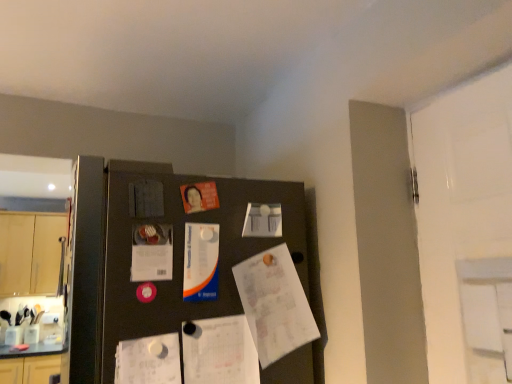
The height and width of the screenshot is (384, 512). What do you see at coordinates (149, 360) in the screenshot?
I see `white paper at lower left, the 6th poster when ordered from top to bottom` at bounding box center [149, 360].

This screenshot has width=512, height=384. What do you see at coordinates (201, 262) in the screenshot?
I see `blue glossy poster at center, the 5th poster viewed from the top` at bounding box center [201, 262].

Locate an element on the screen. This screenshot has height=384, width=512. white glossy paper at upper center, the third poster when ordered from top to bottom is located at coordinates (263, 220).

Locate an element on the screen. This screenshot has height=384, width=512. metallic silver poster at center, positioned as the 6th poster in bottom-to-top order is located at coordinates (146, 198).

I want to click on matte paper poster at center-left, which appears as the 4th poster when ordered from the bottom, so click(152, 253).

What are the coordinates of `white paper at lower left, the 6th poster when ordered from top to bottom` in the screenshot? It's located at (149, 360).

Is black matte fridge at center closer to the viewer compared to white paper at lower left, the 2th poster from the bottom?

Yes, it is.

Between black matte fridge at center and white paper at lower left, the 2th poster from the bottom, which one has smaller width?

Thinner between the two is white paper at lower left, the 2th poster from the bottom.

Locate an element on the screen. The height and width of the screenshot is (384, 512). fridge that is above the white paper at lower left, the 6th poster when ordered from top to bottom (from a real-world perspective) is located at coordinates (188, 286).

Considering the relative sizes of black matte fridge at center and white paper at lower left, the 6th poster when ordered from top to bottom, in the image provided, is black matte fridge at center taller than white paper at lower left, the 6th poster when ordered from top to bottom,?

Yes.

From a real-world perspective, which object rests below the other?

black matte fridge at center, from a real-world perspective.

Which of these two, light wood cabinet at left or black matte fridge at center, is bigger?

black matte fridge at center.

From the image's perspective, is light wood cabinet at left located above or below black matte fridge at center?

Clearly, from the image's perspective, light wood cabinet at left is below black matte fridge at center.

Could you tell me if light wood cabinet at left is facing black matte fridge at center?

Yes, light wood cabinet at left is turned towards black matte fridge at center.

Is metallic silver poster at center, positioned as the 6th poster in bottom-to-top order, positioned far away from orange matte poster at upper center, marked as the 1th poster in a top-to-bottom arrangement?

No, there isn't a large distance between metallic silver poster at center, positioned as the 6th poster in bottom-to-top order, and orange matte poster at upper center, marked as the 1th poster in a top-to-bottom arrangement.

From the image's perspective, relative to orange matte poster at upper center, marked as the 1th poster in a top-to-bottom arrangement, is metallic silver poster at center, the 2th poster when ordered from top to bottom, above or below?

From the image's perspective, metallic silver poster at center, the 2th poster when ordered from top to bottom, appears below orange matte poster at upper center, marked as the 1th poster in a top-to-bottom arrangement.

Which of these two, metallic silver poster at center, positioned as the 6th poster in bottom-to-top order, or orange matte poster at upper center, marked as the 1th poster in a top-to-bottom arrangement, is wider?

With larger width is metallic silver poster at center, positioned as the 6th poster in bottom-to-top order.

Based on the photo, could you tell me if metallic silver poster at center, positioned as the 6th poster in bottom-to-top order, is facing orange matte poster at upper center, the 7th poster positioned from the bottom?

No.

Is metallic silver poster at center, the 2th poster when ordered from top to bottom, facing towards matte paper poster at center-left, which appears as the 4th poster when ordered from the bottom?

No, metallic silver poster at center, the 2th poster when ordered from top to bottom, is not turned towards matte paper poster at center-left, which appears as the 4th poster when ordered from the bottom.

From the image's perspective, is metallic silver poster at center, positioned as the 6th poster in bottom-to-top order, below matte paper poster at center-left, which appears as the 4th poster when ordered from the bottom?

Actually, metallic silver poster at center, positioned as the 6th poster in bottom-to-top order, appears above matte paper poster at center-left, which appears as the 4th poster when ordered from the bottom, in the image.

Which of these two, metallic silver poster at center, the 2th poster when ordered from top to bottom, or matte paper poster at center-left, which appears as the 4th poster when ordered from the bottom, stands taller?

Standing taller between the two is matte paper poster at center-left, which appears as the 4th poster when ordered from the bottom.

From a real-world perspective, which is physically below, blue glossy poster at center, which appears as the third poster when ordered from the bottom, or matte paper poster at center-left, which appears as the 4th poster when ordered from the bottom?

blue glossy poster at center, which appears as the third poster when ordered from the bottom, is physically lower.

Which is behind, point (214, 254) or point (143, 279)?

The point (214, 254) is more distant.

Is blue glossy poster at center, which appears as the third poster when ordered from the bottom, outside of matte paper poster at center-left, the 4th poster positioned from the top?

Yes, blue glossy poster at center, which appears as the third poster when ordered from the bottom, is not within matte paper poster at center-left, the 4th poster positioned from the top.

In the scene shown: Is blue glossy poster at center, the 5th poster viewed from the top, placed right next to matte paper poster at center-left, which appears as the 4th poster when ordered from the bottom?

Absolutely, blue glossy poster at center, the 5th poster viewed from the top, is next to and touching matte paper poster at center-left, which appears as the 4th poster when ordered from the bottom.

Consider the image. Considering the sizes of objects orange matte poster at upper center, marked as the 1th poster in a top-to-bottom arrangement, and matte paper poster at center-left, the 4th poster positioned from the top, in the image provided, who is bigger, orange matte poster at upper center, marked as the 1th poster in a top-to-bottom arrangement, or matte paper poster at center-left, the 4th poster positioned from the top,?

Bigger between the two is matte paper poster at center-left, the 4th poster positioned from the top.

Is orange matte poster at upper center, marked as the 1th poster in a top-to-bottom arrangement, directly adjacent to matte paper poster at center-left, the 4th poster positioned from the top?

orange matte poster at upper center, marked as the 1th poster in a top-to-bottom arrangement, is not next to matte paper poster at center-left, the 4th poster positioned from the top, and they're not touching.

Which is in front, point (184, 196) or point (143, 244)?

Point (143, 244)

Could you tell me if orange matte poster at upper center, the 7th poster positioned from the bottom, is facing matte paper poster at center-left, which appears as the 4th poster when ordered from the bottom?

No, orange matte poster at upper center, the 7th poster positioned from the bottom, is not oriented towards matte paper poster at center-left, which appears as the 4th poster when ordered from the bottom.

From the picture: Is metallic silver poster at center, positioned as the 6th poster in bottom-to-top order, to the right of blue glossy poster at center, the 5th poster viewed from the top, from the viewer's perspective?

No.

In the scene shown: Would you consider metallic silver poster at center, positioned as the 6th poster in bottom-to-top order, to be distant from blue glossy poster at center, which appears as the third poster when ordered from the bottom?

metallic silver poster at center, positioned as the 6th poster in bottom-to-top order, is actually quite close to blue glossy poster at center, which appears as the third poster when ordered from the bottom.

From a real-world perspective, starting from the metallic silver poster at center, positioned as the 6th poster in bottom-to-top order, which poster is the 3rd one below it? Please provide its 2D coordinates.

[(201, 262)]

Looking at this image, from a real-world perspective, does metallic silver poster at center, the 2th poster when ordered from top to bottom, stand above blue glossy poster at center, which appears as the third poster when ordered from the bottom?

Yes.

Find the location of a particular element. The width and height of the screenshot is (512, 384). the 2nd poster directly beneath the black matte fridge at center (from a real-world perspective) is located at coordinates (149, 360).

In order to click on cabinetry lying behind the black matte fridge at center in this screenshot , I will do `click(30, 253)`.

Considering their positions, is white paper at lower left, the 6th poster when ordered from top to bottom, positioned closer to blue glossy poster at center, which appears as the third poster when ordered from the bottom, than matte paper poster at center-left, which appears as the 4th poster when ordered from the bottom?

matte paper poster at center-left, which appears as the 4th poster when ordered from the bottom, lies closer to blue glossy poster at center, which appears as the third poster when ordered from the bottom, than the other object.

Considering their positions, is matte paper poster at center-left, the 4th poster positioned from the top, positioned further to orange matte poster at upper center, the 7th poster positioned from the bottom, than blue glossy poster at center, which appears as the third poster when ordered from the bottom?

The object further to orange matte poster at upper center, the 7th poster positioned from the bottom, is matte paper poster at center-left, the 4th poster positioned from the top.

Which object lies nearer to the anchor point black matte fridge at center, matte paper poster at center-left, which appears as the 4th poster when ordered from the bottom, or light wood cabinet at left?

Based on the image, matte paper poster at center-left, which appears as the 4th poster when ordered from the bottom, appears to be nearer to black matte fridge at center.

Looking at the image, which one is located closer to black matte fridge at center, white glossy paper at upper center, which ranks as the 5th poster in bottom-to-top order, or metallic silver poster at center, positioned as the 6th poster in bottom-to-top order?

The object closer to black matte fridge at center is white glossy paper at upper center, which ranks as the 5th poster in bottom-to-top order.

In the scene shown: Considering their positions, is black matte fridge at center positioned further to white paper at center, the first poster when ordered from bottom to top, than blue glossy poster at center, which appears as the third poster when ordered from the bottom?

blue glossy poster at center, which appears as the third poster when ordered from the bottom, is further to white paper at center, the first poster when ordered from bottom to top.

Considering their positions, is white paper at lower left, the 2th poster from the bottom, positioned closer to light wood cabinet at left than white paper at center, the first poster when ordered from bottom to top?

Among the two, white paper at lower left, the 2th poster from the bottom, is located nearer to light wood cabinet at left.

Considering their positions, is white paper at center, arranged as the seventh poster when viewed from the top, positioned further to white glossy paper at upper center, which ranks as the 5th poster in bottom-to-top order, than blue glossy poster at center, which appears as the third poster when ordered from the bottom?

white paper at center, arranged as the seventh poster when viewed from the top, lies further to white glossy paper at upper center, which ranks as the 5th poster in bottom-to-top order, than the other object.

From the image, which object appears to be nearer to blue glossy poster at center, the 5th poster viewed from the top, white paper at center, arranged as the seventh poster when viewed from the top, or matte paper poster at center-left, the 4th poster positioned from the top?

Based on the image, matte paper poster at center-left, the 4th poster positioned from the top, appears to be nearer to blue glossy poster at center, the 5th poster viewed from the top.

Image resolution: width=512 pixels, height=384 pixels. I want to click on fridge between blue glossy poster at center, which appears as the third poster when ordered from the bottom, and white paper at lower left, the 2th poster from the bottom, from top to bottom, so click(188, 286).

Image resolution: width=512 pixels, height=384 pixels. In order to click on poster between blue glossy poster at center, which appears as the third poster when ordered from the bottom, and white paper at center, the first poster when ordered from bottom to top, in the vertical direction in this screenshot , I will do `click(149, 360)`.

Locate an element on the screen. This screenshot has height=384, width=512. poster positioned between orange matte poster at upper center, marked as the 1th poster in a top-to-bottom arrangement, and light wood cabinet at left from near to far is located at coordinates (263, 220).

You are a GUI agent. You are given a task and a screenshot of the screen. Output one action in this format:
    pyautogui.click(x=<x>, y=<y>)
    Task: Click on the fridge that lies between metallic silver poster at center, the 2th poster when ordered from top to bottom, and white paper at center, the first poster when ordered from bottom to top, from top to bottom
    
    Given the screenshot: What is the action you would take?
    pyautogui.click(x=188, y=286)